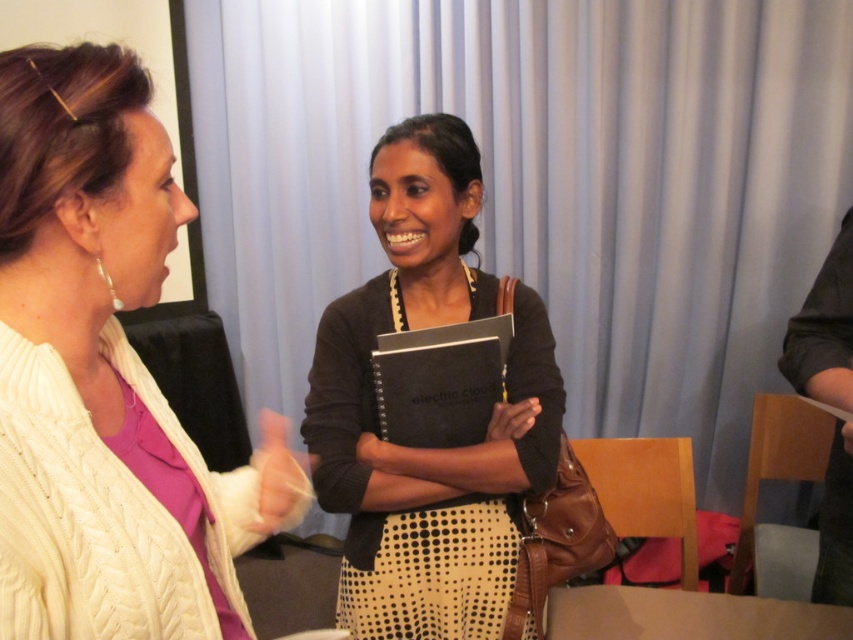
Question: Does black matte notebook at center have a smaller size compared to smooth brown table at lower center?

Choices:
 (A) no
 (B) yes

Answer: (A)

Question: Can you confirm if white cable-knit sweater at left is positioned below yellow matte hand at center?

Choices:
 (A) yes
 (B) no

Answer: (B)

Question: Among these points, which one is farthest from the camera?

Choices:
 (A) (500, 413)
 (B) (674, 593)
 (C) (515, 445)

Answer: (B)

Question: Which object is the farthest from the smooth brown table at lower center?

Choices:
 (A) yellow matte hand at center
 (B) white cable-knit sweater at left
 (C) black matte notebook at center

Answer: (B)

Question: Which is farther from the black matte notebook at center?

Choices:
 (A) yellow matte hand at center
 (B) white cable-knit sweater at left

Answer: (B)

Question: Is white cable-knit sweater at left thinner than smooth brown table at lower center?

Choices:
 (A) yes
 (B) no

Answer: (A)